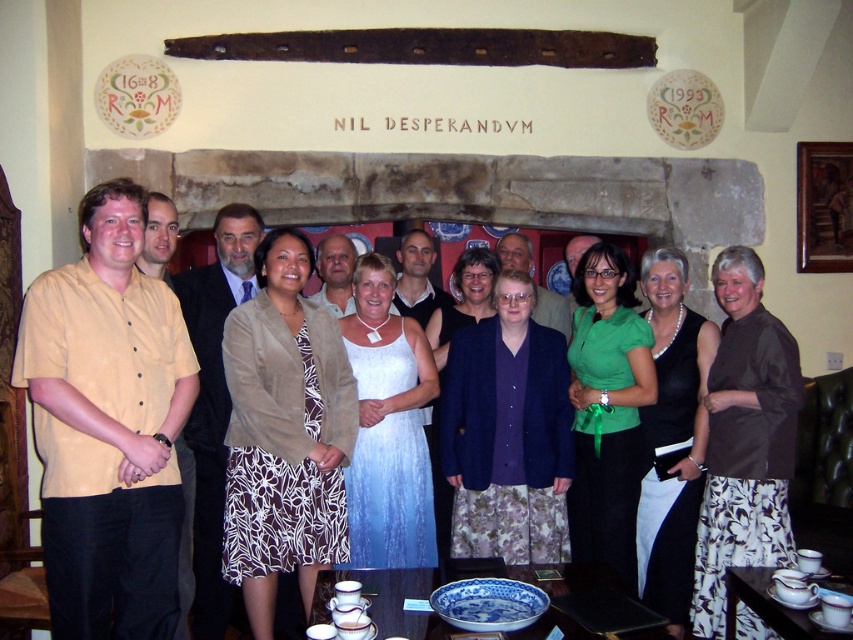
Looking at this image, you are at a social gathering in a rustic room with a stone fireplace. You see a point marked at coordinates (108,426). What object is located at that point?

The point at coordinates (108,426) indicates the location of the matte yellow shirt at center.

You are a photographer trying to adjust the lighting for a group photo. You notice two key figures in the scene, the green matte shirt at center and the matte beige blazer at center. Which of these two is closer to the camera, and why?

The green matte shirt at center is closer to the camera because it is positioned in front of the matte beige blazer at center, as stated in the description.